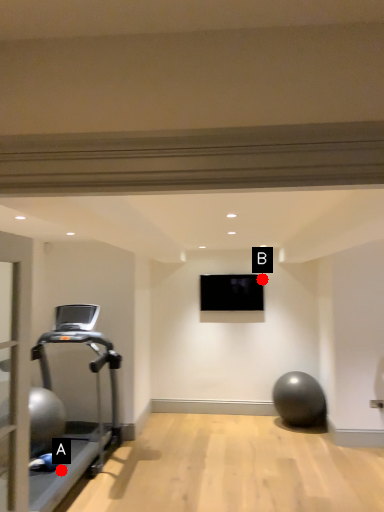
Question: Two points are circled on the image, labeled by A and B beside each circle. Which point appears closest to the camera in this image?

Choices:
 (A) A is closer
 (B) B is closer

Answer: (A)